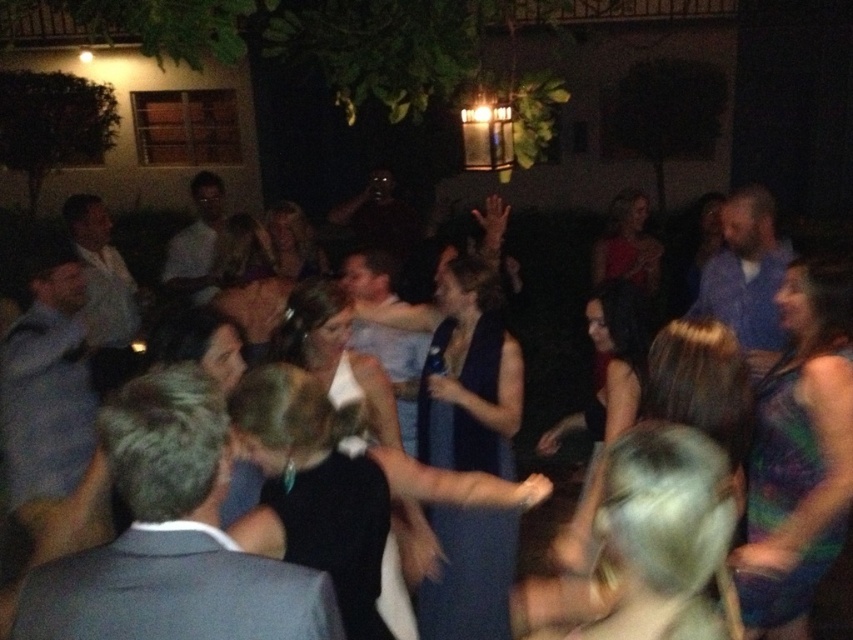
Question: Is the position of dark blue satin dress at center more distant than that of green satin dress at lower right?

Choices:
 (A) yes
 (B) no

Answer: (A)

Question: Among these points, which one is nearest to the camera?

Choices:
 (A) (811, 483)
 (B) (496, 593)
 (C) (425, 554)

Answer: (A)

Question: Which point is farther from the camera taking this photo?

Choices:
 (A) (485, 378)
 (B) (764, 449)
 (C) (425, 561)

Answer: (A)

Question: Does dark blue satin dress at center appear on the right side of green satin dress at lower right?

Choices:
 (A) yes
 (B) no

Answer: (B)

Question: Does green satin dress at lower right appear under blue dress at center?

Choices:
 (A) no
 (B) yes

Answer: (A)

Question: Among these objects, which one is nearest to the camera?

Choices:
 (A) blue dress at center
 (B) dark blue satin dress at center

Answer: (A)